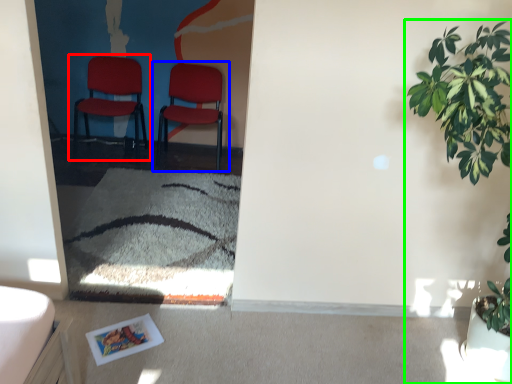
Question: Based on their relative distances, which object is farther from chair (highlighted by a red box)? Choose from chair (highlighted by a blue box) and houseplant (highlighted by a green box).

Choices:
 (A) chair
 (B) houseplant

Answer: (B)